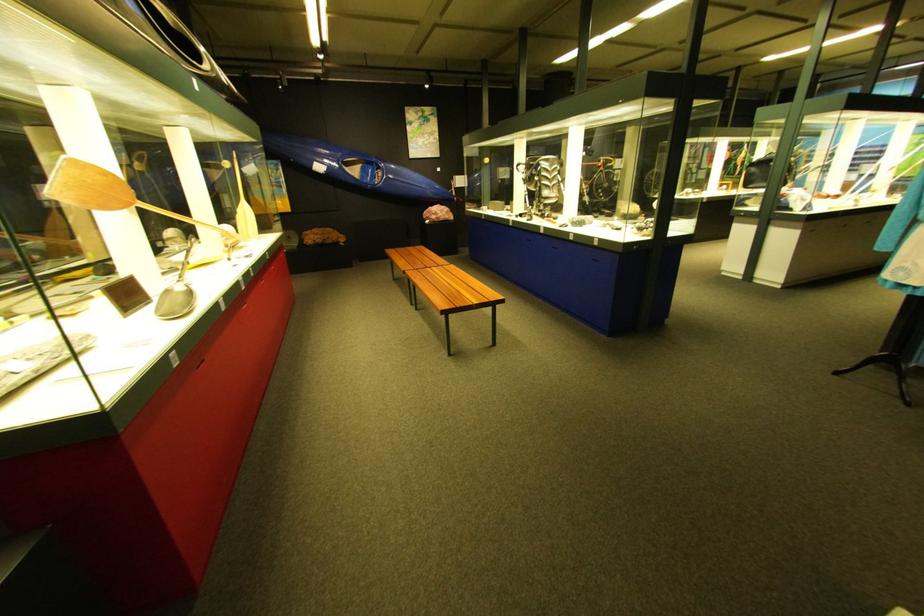
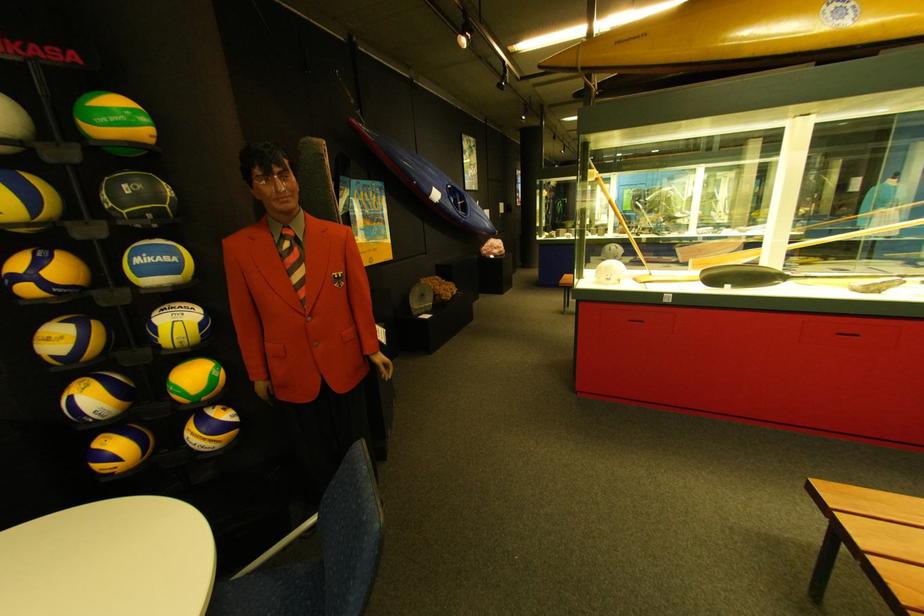
Find the pixel in the second image that matches (440,219) in the first image.

(500, 254)